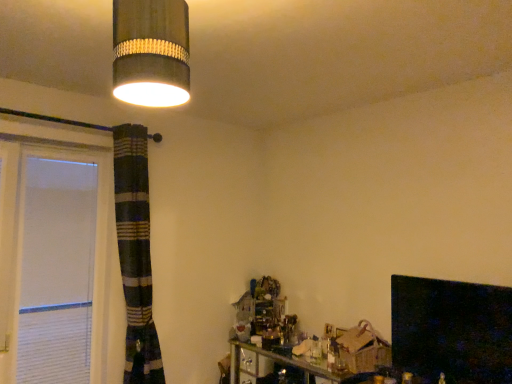
Identify the location of black glossy fireplace at lower right. [451, 330].

What do you see at coordinates (451, 330) in the screenshot? The image size is (512, 384). I see `black glossy fireplace at lower right` at bounding box center [451, 330].

Measure the distance between point (480,365) and camera.

Point (480,365) and camera are 6.73 feet apart from each other.

Where is `matte gray cylindrical lampshade at upper left`? matte gray cylindrical lampshade at upper left is located at coordinates (x=151, y=52).

Describe the element at coordinates (151, 52) in the screenshot. I see `matte gray cylindrical lampshade at upper left` at that location.

At what (x,y) coordinates should I click in order to perform the action: click on black glossy fireplace at lower right. Please return your answer as a coordinate pair (x, y). This screenshot has width=512, height=384. Looking at the image, I should click on (451, 330).

Which object is positioned more to the right, black glossy fireplace at lower right or matte gray cylindrical lampshade at upper left?

From the viewer's perspective, black glossy fireplace at lower right appears more on the right side.

Does black glossy fireplace at lower right lie in front of matte gray cylindrical lampshade at upper left?

No, black glossy fireplace at lower right is further to the viewer.

Is point (480, 362) positioned after point (176, 34)?

That is True.

From the image's perspective, relative to matte gray cylindrical lampshade at upper left, is black glossy fireplace at lower right above or below?

black glossy fireplace at lower right is situated lower than matte gray cylindrical lampshade at upper left in the image.

From a real-world perspective, who is located lower, black glossy fireplace at lower right or matte gray cylindrical lampshade at upper left?

From a 3D spatial view, black glossy fireplace at lower right is below.

Considering the sizes of objects black glossy fireplace at lower right and matte gray cylindrical lampshade at upper left in the image provided, who is wider, black glossy fireplace at lower right or matte gray cylindrical lampshade at upper left?

black glossy fireplace at lower right.

From the picture: Is black glossy fireplace at lower right shorter than matte gray cylindrical lampshade at upper left?

No.

In terms of size, does black glossy fireplace at lower right appear bigger or smaller than matte gray cylindrical lampshade at upper left?

In the image, black glossy fireplace at lower right appears to be larger than matte gray cylindrical lampshade at upper left.

Would you say matte gray cylindrical lampshade at upper left is part of black glossy fireplace at lower right's contents?

No, matte gray cylindrical lampshade at upper left is not inside black glossy fireplace at lower right.

Are black glossy fireplace at lower right and matte gray cylindrical lampshade at upper left far apart?

That's right, there is a large distance between black glossy fireplace at lower right and matte gray cylindrical lampshade at upper left.

Is matte gray cylindrical lampshade at upper left at the back of black glossy fireplace at lower right?

No, black glossy fireplace at lower right's orientation is not away from matte gray cylindrical lampshade at upper left.

Could you measure the distance between black glossy fireplace at lower right and matte gray cylindrical lampshade at upper left?

black glossy fireplace at lower right is 6.03 feet away from matte gray cylindrical lampshade at upper left.

Identify the location of fireplace that appears on the right of matte gray cylindrical lampshade at upper left. The image size is (512, 384). (451, 330).

Which object is positioned more to the left, matte gray cylindrical lampshade at upper left or black glossy fireplace at lower right?

Positioned to the left is matte gray cylindrical lampshade at upper left.

Considering the relative positions of matte gray cylindrical lampshade at upper left and black glossy fireplace at lower right in the image provided, is matte gray cylindrical lampshade at upper left behind black glossy fireplace at lower right?

No, matte gray cylindrical lampshade at upper left is in front of black glossy fireplace at lower right.

Which is farther, (167, 21) or (455, 373)?

Positioned behind is point (455, 373).

From the image's perspective, is matte gray cylindrical lampshade at upper left beneath black glossy fireplace at lower right?

No, from the image's perspective, matte gray cylindrical lampshade at upper left is not beneath black glossy fireplace at lower right.

From a real-world perspective, which is physically below, matte gray cylindrical lampshade at upper left or black glossy fireplace at lower right?

In real-world perspective, black glossy fireplace at lower right is lower.

Between matte gray cylindrical lampshade at upper left and black glossy fireplace at lower right, which one has smaller width?

With smaller width is matte gray cylindrical lampshade at upper left.

From the picture: Is matte gray cylindrical lampshade at upper left taller than black glossy fireplace at lower right?

No.

Is matte gray cylindrical lampshade at upper left smaller than black glossy fireplace at lower right?

Yes.

Could black glossy fireplace at lower right be considered to be inside matte gray cylindrical lampshade at upper left?

No.

Is the surface of matte gray cylindrical lampshade at upper left in direct contact with black glossy fireplace at lower right?

No, matte gray cylindrical lampshade at upper left is not next to black glossy fireplace at lower right.

Could you tell me if matte gray cylindrical lampshade at upper left is turned towards black glossy fireplace at lower right?

No, matte gray cylindrical lampshade at upper left is not oriented towards black glossy fireplace at lower right.

How different are the orientations of matte gray cylindrical lampshade at upper left and black glossy fireplace at lower right in degrees?

The facing directions of matte gray cylindrical lampshade at upper left and black glossy fireplace at lower right are 178 degrees apart.

At what (x,y) coordinates should I click in order to perform the action: click on lamp above the black glossy fireplace at lower right (from the image's perspective). Please return your answer as a coordinate pair (x, y). The height and width of the screenshot is (384, 512). Looking at the image, I should click on (151, 52).

Find the location of a particular element. The height and width of the screenshot is (384, 512). lamp in front of the black glossy fireplace at lower right is located at coordinates (151, 52).

At what (x,y) coordinates should I click in order to perform the action: click on fireplace that appears below the matte gray cylindrical lampshade at upper left (from the image's perspective). Please return your answer as a coordinate pair (x, y). Looking at the image, I should click on (451, 330).